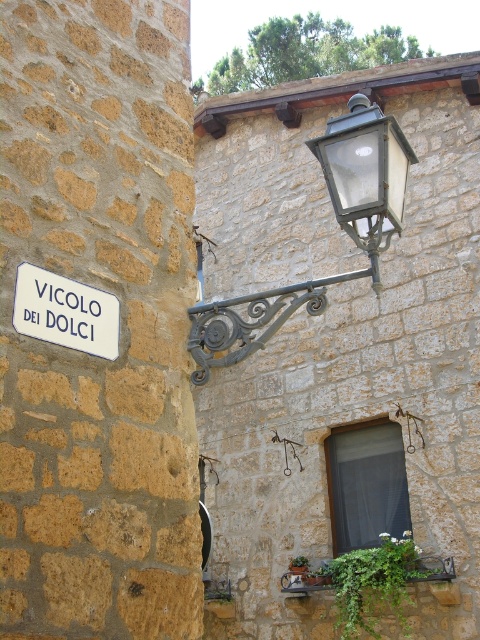
You are a tourist holding a map and looking at the matte glass streetlight at upper right and the white matte street sign at lower left. Which object is closer to you?

The white matte street sign at lower left is behind the matte glass streetlight at upper right, so the matte glass streetlight at upper right is closer to you.

You are a tourist walking down the street and want to take a photo of the matte black lantern at upper center and the matte glass streetlight at upper right. Which object will appear closer to you in the photo?

The matte black lantern at upper center will appear closer to you in the photo because it is positioned in front of the matte glass streetlight at upper right.

You are a delivery person trying to navigate through Sweet Alley. You need to pass between the matte black lantern at upper center and the white matte street sign at lower left. Can your 1.2 meter wide delivery cart fit through the space between them?

The matte black lantern at upper center is wider than the white matte street sign at lower left. However, the question is about the space between them, not their widths. The provided description does not mention the distance between the two objects, so it cannot be determined if the 1.2 meter wide delivery cart can fit through the space between the matte black lantern at upper center and the white matte street sign at lower left.